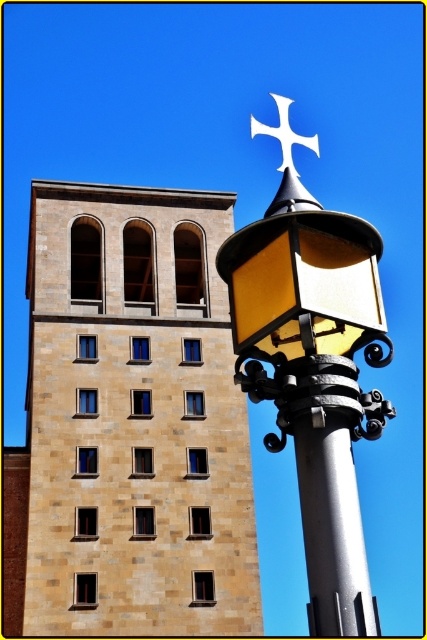
Question: Is metallic/yellow street light at upper right closer to camera compared to silver metallic pole at center?

Choices:
 (A) yes
 (B) no

Answer: (B)

Question: Does metallic/yellow street light at upper right lie behind silver metallic pole at center?

Choices:
 (A) yes
 (B) no

Answer: (A)

Question: Which point is farther to the camera?

Choices:
 (A) coord(301,136)
 (B) coord(272,317)
 (C) coord(363,634)
 (D) coord(82,193)

Answer: (D)

Question: Which point appears farthest from the camera in this image?

Choices:
 (A) (347, 566)
 (B) (184, 394)
 (C) (263, 129)

Answer: (B)

Question: Which point is farther from the camera taking this photo?

Choices:
 (A) (338, 620)
 (B) (49, 401)
 (C) (348, 387)
 (D) (274, 97)

Answer: (D)

Question: Can you confirm if metallic/yellow street light at upper right is positioned below white metal cross at upper center?

Choices:
 (A) yes
 (B) no

Answer: (A)